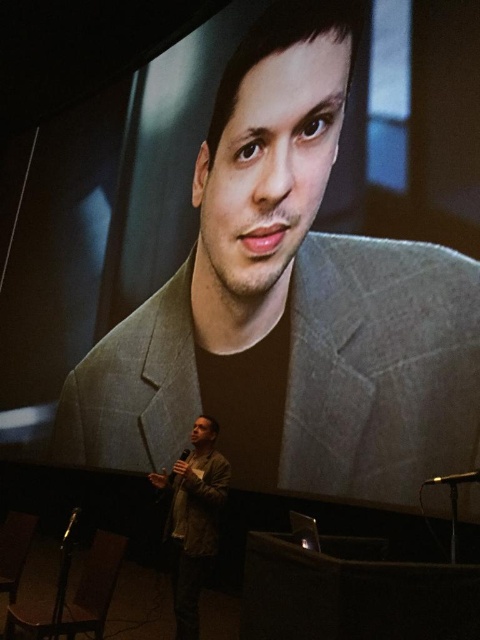
From the picture: You are sitting in the conference room and want to determine which of the two points, point (421,388) or point (213,508), is nearer to you. Based on the scene, which point is closer?

Point (421,388) is closer to the viewer than point (213,508).